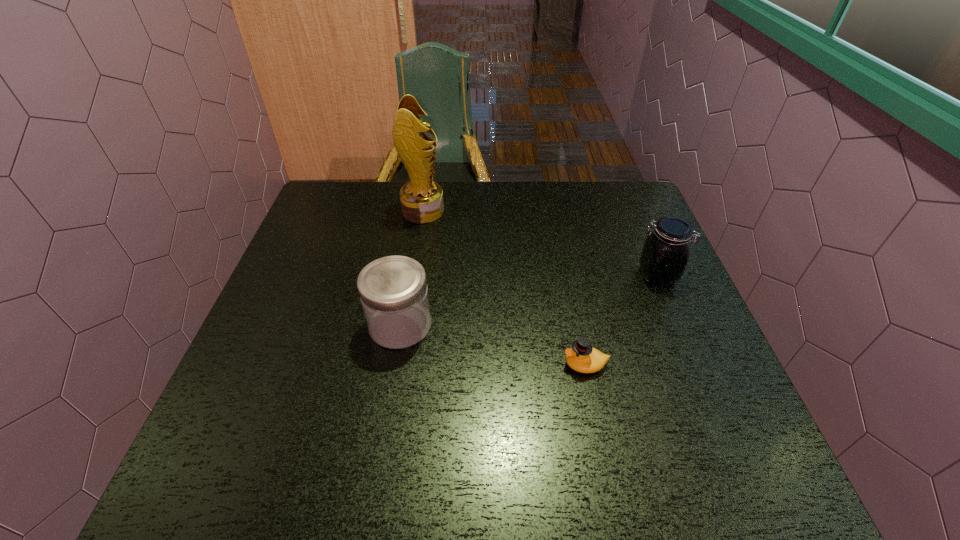
What are the coordinates of `object that can be found as the second closest to the tallest object` in the screenshot? It's located at (665, 254).

You are a GUI agent. You are given a task and a screenshot of the screen. Output one action in this format:
    pyautogui.click(x=<x>, y=<y>)
    Task: Click on the object that stands as the second closest to the farthest object
    
    Given the screenshot: What is the action you would take?
    pyautogui.click(x=665, y=254)